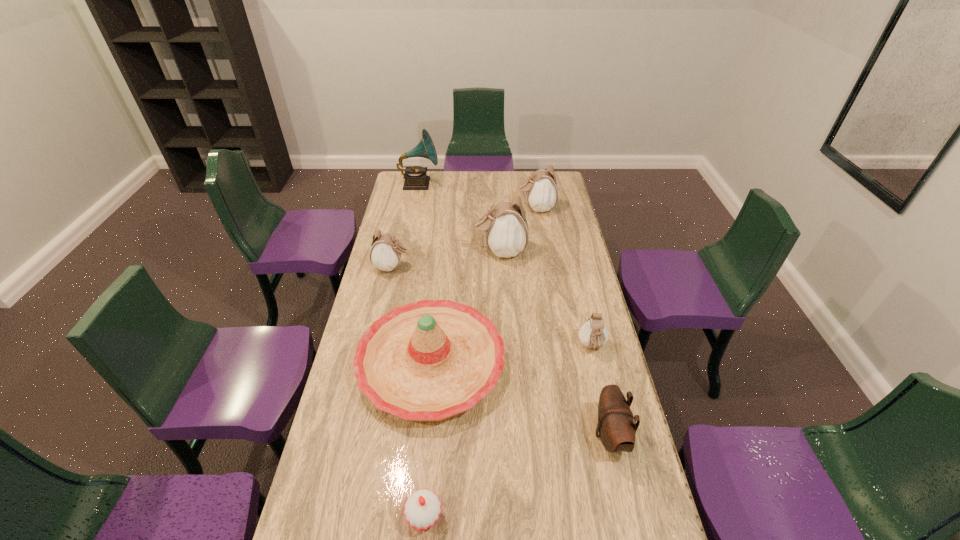
Identify the location of pink cupcake. (422, 509).

At what (x,y) coordinates should I click in order to perform the action: click on cupcake. Please return your answer as a coordinate pair (x, y). The image size is (960, 540). Looking at the image, I should click on (422, 509).

Where is `vacant region located 0.330m from the horn of the farthest object`? vacant region located 0.330m from the horn of the farthest object is located at coordinates (500, 184).

Where is `vacant space situated 0.260m on the front-facing side of the biggest white pouch`? vacant space situated 0.260m on the front-facing side of the biggest white pouch is located at coordinates (413, 251).

This screenshot has width=960, height=540. What are the coordinates of `free space located 0.280m on the front-facing side of the biggest white pouch` in the screenshot? It's located at (409, 251).

The width and height of the screenshot is (960, 540). Identify the location of vacant area situated 0.400m on the front-facing side of the biggest white pouch. (381, 251).

The image size is (960, 540). I want to click on free space located on the front-facing side of the second tallest pouch, so click(x=481, y=208).

Locate an element on the screen. free space located on the front-facing side of the second tallest pouch is located at coordinates (490, 208).

The width and height of the screenshot is (960, 540). I want to click on free space located on the front-facing side of the second tallest pouch, so click(x=455, y=208).

You are a GUI agent. You are given a task and a screenshot of the screen. Output one action in this format:
    pyautogui.click(x=<x>, y=<y>)
    Task: Click on the vacant space located on the front of the red sombrero
    The width and height of the screenshot is (960, 540).
    Given the screenshot: What is the action you would take?
    pyautogui.click(x=421, y=464)